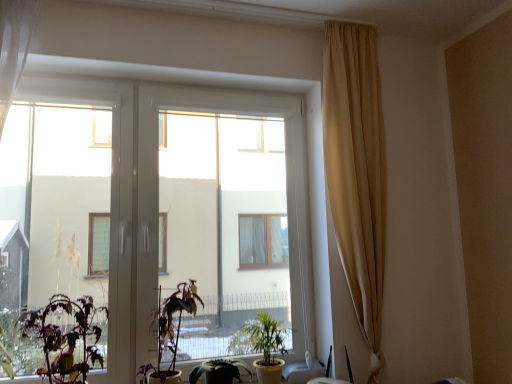
Question: Can green matte plant at lower left, which ranks as the first houseplant in left-to-right order, be found inside transparent glass window at center?

Choices:
 (A) yes
 (B) no

Answer: (A)

Question: Is transparent glass window at center taller than green matte plant at lower left, positioned as the 4th houseplant in right-to-left order?

Choices:
 (A) yes
 (B) no

Answer: (A)

Question: From a real-world perspective, does transparent glass window at center stand above green matte plant at lower left, which ranks as the first houseplant in left-to-right order?

Choices:
 (A) no
 (B) yes

Answer: (B)

Question: From the image's perspective, would you say transparent glass window at center is shown under green matte plant at lower left, which ranks as the first houseplant in left-to-right order?

Choices:
 (A) yes
 (B) no

Answer: (B)

Question: Is transparent glass window at center smaller than green matte plant at lower left, positioned as the 4th houseplant in right-to-left order?

Choices:
 (A) no
 (B) yes

Answer: (A)

Question: Is point (56, 336) closer or farther from the camera than point (243, 367)?

Choices:
 (A) closer
 (B) farther

Answer: (A)

Question: Is green matte plant at lower left, positioned as the 4th houseplant in right-to-left order, taller or shorter than green matte plant at lower center, the second houseplant viewed from the right?

Choices:
 (A) short
 (B) tall

Answer: (B)

Question: From the image's perspective, is green matte plant at lower left, which ranks as the first houseplant in left-to-right order, positioned above or below green matte plant at lower center, the second houseplant viewed from the right?

Choices:
 (A) below
 (B) above

Answer: (B)

Question: In terms of width, does green matte plant at lower left, which ranks as the first houseplant in left-to-right order, look wider or thinner when compared to green matte plant at lower center, the second houseplant viewed from the right?

Choices:
 (A) wide
 (B) thin

Answer: (A)

Question: Is transparent glass window at center bigger or smaller than green matte plant at lower left, which ranks as the first houseplant in left-to-right order?

Choices:
 (A) small
 (B) big

Answer: (B)

Question: From the image's perspective, is transparent glass window at center positioned above or below green matte plant at lower left, which ranks as the first houseplant in left-to-right order?

Choices:
 (A) below
 (B) above

Answer: (B)

Question: Looking at their shapes, would you say transparent glass window at center is wider or thinner than green matte plant at lower left, positioned as the 4th houseplant in right-to-left order?

Choices:
 (A) wide
 (B) thin

Answer: (B)

Question: Considering the positions of point (129, 263) and point (93, 324), is point (129, 263) closer or farther from the camera than point (93, 324)?

Choices:
 (A) closer
 (B) farther

Answer: (B)

Question: Is transparent glass window at center in front of or behind purple matte plant at center, which is the third houseplant from right to left, in the image?

Choices:
 (A) front
 (B) behind

Answer: (B)

Question: From the image's perspective, is transparent glass window at center located above or below purple matte plant at center, which is counted as the 2th houseplant, starting from the left?

Choices:
 (A) below
 (B) above

Answer: (B)